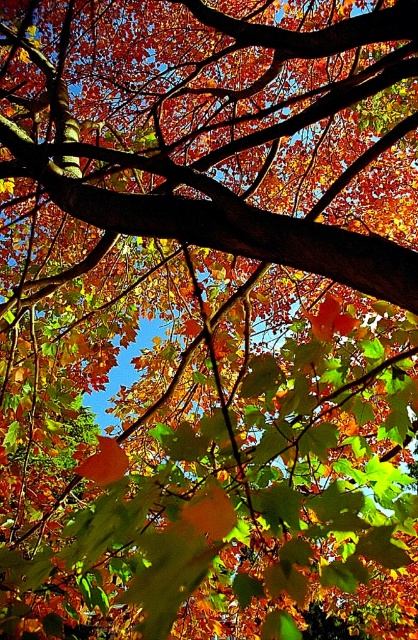
Based on the photo, you are standing under the autumn tree and looking up. There is a smooth brown branch at center. Can you tell me what is located at the coordinate point (224, 224)?

At point (224, 224) lies smooth brown branch at center.

In the scene shown: You are standing under the autumn tree and want to reach the smooth brown branch at center. Based on your position, is this branch directly above you or to one side?

The smooth brown branch at center is located at point coordinates, so it is directly above you.

You are a bird perched on a branch in the autumn tree. You want to fly to the nearest leaf to rest. Which object is closer to you, the smooth brown branch at center or the orange matte maple leaf at center?

The smooth brown branch at center is closer to you since it is in front of the orange matte maple leaf at center.